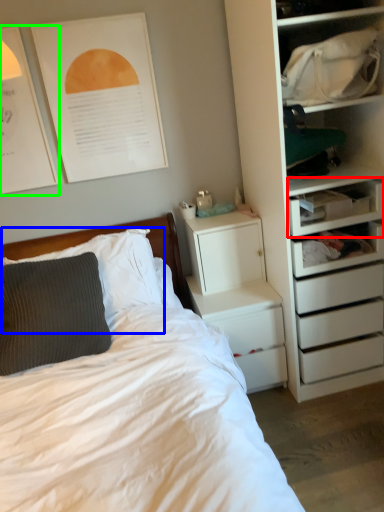
Question: Which is farther away from shelf (highlighted by a red box)? pillow (highlighted by a blue box) or poster page (highlighted by a green box)?

Choices:
 (A) pillow
 (B) poster page

Answer: (B)